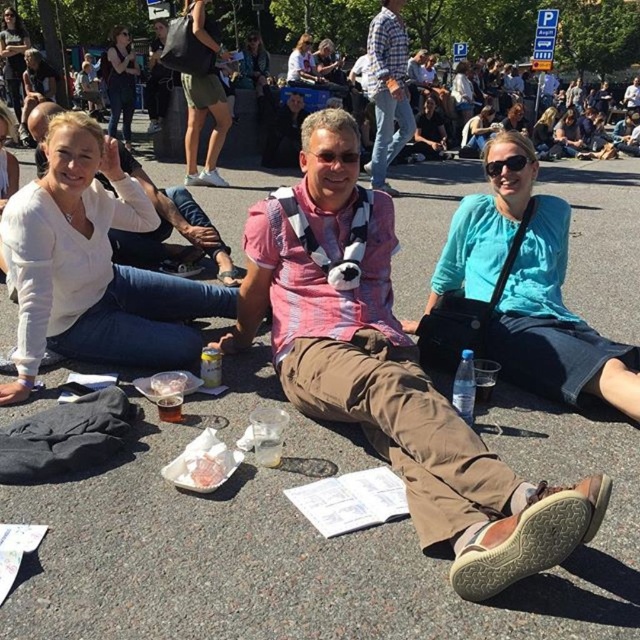
Please look at the image and locate the point at coordinates (518, 296). Which object from the scene does this point fall on?

The point at coordinates (518, 296) falls on the teal fabric skirt at center.

You are a photographer trying to capture a closeup shot of the teal fabric skirt at center and the matte black jacket at upper center. Given their sizes, which object should you zoom in more on to ensure both are in focus?

The teal fabric skirt at center occupies less space than the matte black jacket at upper center, so you should zoom in more on the matte black jacket at upper center to ensure both are in focus.